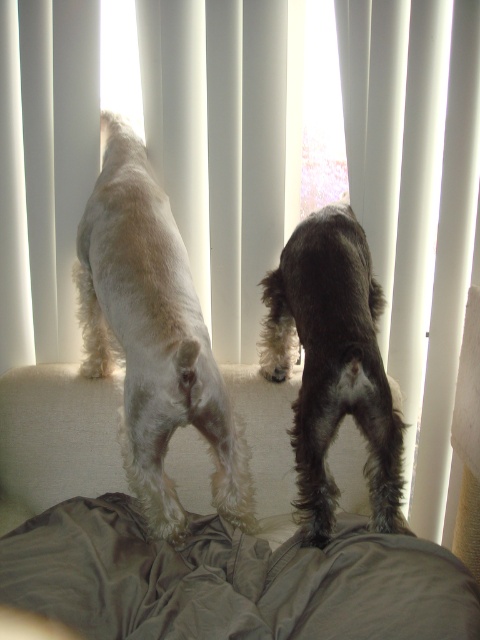
You are a photographer setting up a shot of the white fluffy dog at center and the white fabric curtain at right. You want to ensure both are visible in the frame. Given their sizes, which object should you focus on first to avoid cropping either out?

The white fluffy dog at center takes up more space than the white fabric curtain at right, so you should focus on framing the white fluffy dog at center first to ensure it fits, as the curtain will naturally fit within the same frame.

You are trying to decide whether to hang a decorative banner that is the same width as the white fluffy dog at center on the white fabric curtain at right. Based on the scene description, will the banner fit horizontally on the curtain?

The white fabric curtain at right is narrower than the white fluffy dog at center, so the banner, which is as wide as the dog, will not fit horizontally on the curtain.

You are a photographer setting up a shoot in this living room. You want to ensure that the shiny brown fur at center is fully visible in the photo without being blocked by the white fabric curtain at right. Based on the scene description, can you confirm if this is possible?

The white fabric curtain at right has a greater height compared to shiny brown fur at center, so if the curtain is hanging above the dog, it might block part of the shiny brown fur at center. To ensure full visibility, adjust the camera angle or position to avoid the curtain obstruction.